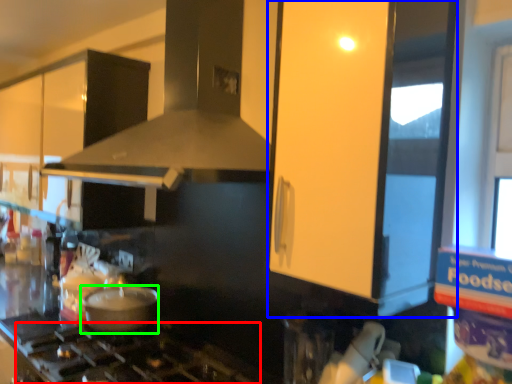
Question: Estimate the real-world distances between objects in this image. Which object is closer to gas stove (highlighted by a red box), glass door (highlighted by a blue box) or kitchen appliance (highlighted by a green box)?

Choices:
 (A) glass door
 (B) kitchen appliance

Answer: (B)